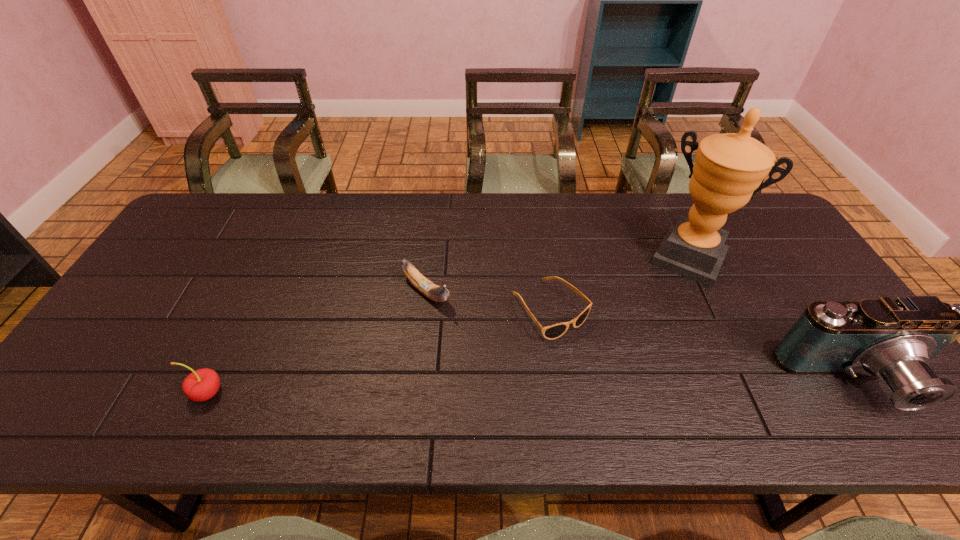
Where is `the leftmost object`? Image resolution: width=960 pixels, height=540 pixels. the leftmost object is located at coordinates (200, 385).

You are a GUI agent. You are given a task and a screenshot of the screen. Output one action in this format:
    pyautogui.click(x=<x>, y=<y>)
    Task: Click on the cherry
    
    Given the screenshot: What is the action you would take?
    pyautogui.click(x=200, y=385)

This screenshot has height=540, width=960. Find the location of `the tallest object`. the tallest object is located at coordinates (729, 168).

You are a GUI agent. You are given a task and a screenshot of the screen. Output one action in this format:
    pyautogui.click(x=<x>, y=<y>)
    Task: Click on the second object from left to right
    Image resolution: width=960 pixels, height=540 pixels.
    Given the screenshot: What is the action you would take?
    pyautogui.click(x=434, y=292)

You are a GUI agent. You are given a task and a screenshot of the screen. Output one action in this format:
    pyautogui.click(x=<x>, y=<y>)
    Task: Click on the fourth tallest object
    The image size is (960, 540).
    Given the screenshot: What is the action you would take?
    pyautogui.click(x=434, y=292)

Image resolution: width=960 pixels, height=540 pixels. I want to click on the third object from left to right, so click(x=551, y=332).

Identify the location of sunglasses. The image size is (960, 540). (551, 332).

Identify the location of free space located 0.350m on the right of the third tallest object. (378, 392).

Image resolution: width=960 pixels, height=540 pixels. Find the location of `blank space located 0.240m at the front of the tallest object with handles`. blank space located 0.240m at the front of the tallest object with handles is located at coordinates (648, 341).

You are a GUI agent. You are given a task and a screenshot of the screen. Output one action in this format:
    pyautogui.click(x=<x>, y=<y>)
    Task: Click on the free space located 0.220m at the front of the tallest object with handles
    Image resolution: width=960 pixels, height=540 pixels.
    Given the screenshot: What is the action you would take?
    pyautogui.click(x=651, y=336)